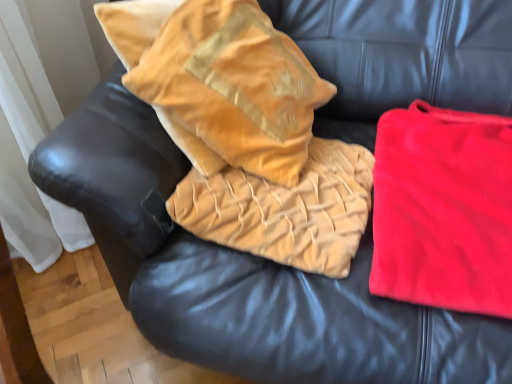
Describe the element at coordinates (443, 209) in the screenshot. I see `red velvet blanket at right` at that location.

What do you see at coordinates (285, 209) in the screenshot? I see `velvet gold pillow at center` at bounding box center [285, 209].

What is the approximate height of velvet gold throw pillow at upper left?

It is 50.73 centimeters.

What are the coordinates of `velvet gold throw pillow at upper left` in the screenshot? It's located at (232, 89).

Identify the location of red velvet blanket at right. The width and height of the screenshot is (512, 384). (443, 209).

In the scene shown: Who is smaller, velvet gold throw pillow at upper left or red velvet blanket at right?

With smaller size is red velvet blanket at right.

What's the angular difference between velvet gold throw pillow at upper left and red velvet blanket at right's facing directions?

There is a 66.1-degree angle between the facing directions of velvet gold throw pillow at upper left and red velvet blanket at right.

From the image's perspective, is velvet gold throw pillow at upper left on top of red velvet blanket at right?

Yes, from the image's perspective, velvet gold throw pillow at upper left is over red velvet blanket at right.

Between velvet gold throw pillow at upper left and red velvet blanket at right, which one has smaller width?

velvet gold throw pillow at upper left.

From the image's perspective, is velvet gold pillow at center over velvet gold throw pillow at upper left?

No.

Image resolution: width=512 pixels, height=384 pixels. I want to click on cloth below the velvet gold throw pillow at upper left (from the image's perspective), so click(285, 209).

Is point (322, 270) positioned after point (224, 74)?

No, (322, 270) is closer to viewer.

From the image's perspective, is velvet gold throw pillow at upper left over velvet gold pillow at center?

Correct, velvet gold throw pillow at upper left appears higher than velvet gold pillow at center in the image.

Looking at this image, is velvet gold throw pillow at upper left looking in the opposite direction of velvet gold pillow at center?

Yes, velvet gold throw pillow at upper left is positioned with its back facing velvet gold pillow at center.

Which is behind, point (193, 46) or point (193, 174)?

The point (193, 174) is more distant.

Looking at this image, which of these two, velvet gold throw pillow at upper left or velvet gold pillow at center, stands taller?

With more height is velvet gold throw pillow at upper left.

Visually, is velvet gold pillow at center positioned to the left or to the right of red velvet blanket at right?

velvet gold pillow at center is positioned on red velvet blanket at right's left side.

In the scene shown: From the image's perspective, is velvet gold pillow at center located above red velvet blanket at right?

Indeed, from the image's perspective, velvet gold pillow at center is shown above red velvet blanket at right.

Measure the distance between velvet gold pillow at center and red velvet blanket at right.

velvet gold pillow at center is 15.13 centimeters from red velvet blanket at right.

Is velvet gold pillow at center next to red velvet blanket at right?

They are not placed beside each other.

Considering the relative sizes of red velvet blanket at right and velvet gold throw pillow at upper left in the image provided, is red velvet blanket at right shorter than velvet gold throw pillow at upper left?

Yes, red velvet blanket at right is shorter than velvet gold throw pillow at upper left.

Is red velvet blanket at right inside the boundaries of velvet gold throw pillow at upper left, or outside?

red velvet blanket at right exists outside the volume of velvet gold throw pillow at upper left.

Is red velvet blanket at right at the left side of velvet gold throw pillow at upper left?

No.

Identify the location of throw pillow to the left of red velvet blanket at right. This screenshot has height=384, width=512. (232, 89).

From the image's perspective, is red velvet blanket at right on velvet gold pillow at center?

No, from the image's perspective, red velvet blanket at right is not above velvet gold pillow at center.

Is red velvet blanket at right to the right of velvet gold pillow at center from the viewer's perspective?

Yes, red velvet blanket at right is to the right of velvet gold pillow at center.

What's the angular difference between red velvet blanket at right and velvet gold pillow at center's facing directions?

red velvet blanket at right and velvet gold pillow at center are facing 2.83 degrees away from each other.

Is red velvet blanket at right not near velvet gold pillow at center?

red velvet blanket at right is actually quite close to velvet gold pillow at center.

Image resolution: width=512 pixels, height=384 pixels. Identify the location of material in front of the velvet gold throw pillow at upper left. (443, 209).

The height and width of the screenshot is (384, 512). I want to click on cloth that is under the velvet gold throw pillow at upper left (from a real-world perspective), so 285,209.

Based on their spatial positions, is velvet gold pillow at center or velvet gold throw pillow at upper left closer to red velvet blanket at right?

velvet gold pillow at center.

Estimate the real-world distances between objects in this image. Which object is further from velvet gold pillow at center, red velvet blanket at right or velvet gold throw pillow at upper left?

red velvet blanket at right is further to velvet gold pillow at center.

Which object lies further to the anchor point velvet gold throw pillow at upper left, red velvet blanket at right or velvet gold pillow at center?

Among the two, red velvet blanket at right is located further to velvet gold throw pillow at upper left.

From the image, which object appears to be nearer to velvet gold pillow at center, velvet gold throw pillow at upper left or red velvet blanket at right?

velvet gold throw pillow at upper left lies closer to velvet gold pillow at center than the other object.

Considering their positions, is velvet gold pillow at center positioned closer to velvet gold throw pillow at upper left than red velvet blanket at right?

Among the two, velvet gold pillow at center is located nearer to velvet gold throw pillow at upper left.

Looking at the image, which one is located closer to red velvet blanket at right, velvet gold throw pillow at upper left or velvet gold pillow at center?

Based on the image, velvet gold pillow at center appears to be nearer to red velvet blanket at right.

In order to click on cloth between velvet gold throw pillow at upper left and red velvet blanket at right from left to right in this screenshot , I will do `click(285, 209)`.